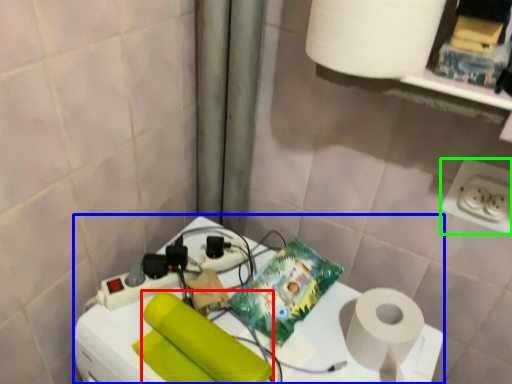
Question: Which is farther away from toilet paper (highlighted by a red box)? appliance (highlighted by a blue box) or power plugs and sockets (highlighted by a green box)?

Choices:
 (A) appliance
 (B) power plugs and sockets

Answer: (B)